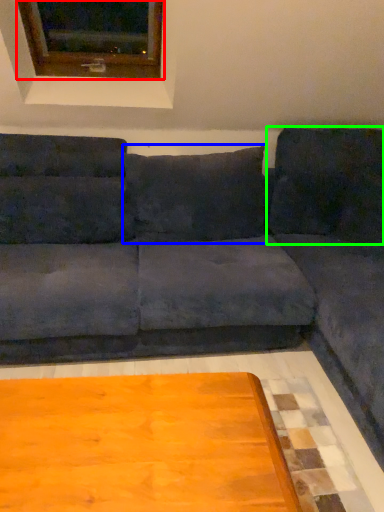
Question: Which is farther away from window (highlighted by a red box)? pillow (highlighted by a blue box) or pillow (highlighted by a green box)?

Choices:
 (A) pillow
 (B) pillow

Answer: (B)